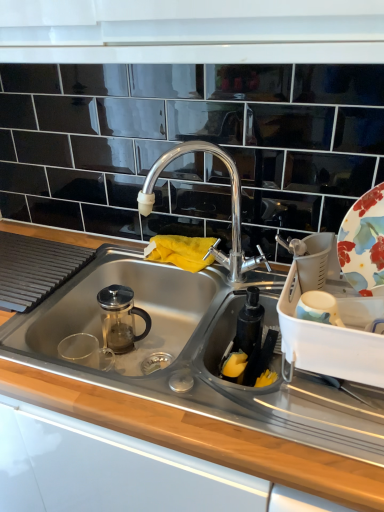
Question: From a real-world perspective, is floral ceramic platter at right positioned above or below stainless steel sink at center?

Choices:
 (A) below
 (B) above

Answer: (B)

Question: Do you think floral ceramic platter at right is within stainless steel sink at center, or outside of it?

Choices:
 (A) outside
 (B) inside

Answer: (A)

Question: Considering the real-world distances, which object is closest to the floral ceramic platter at right?

Choices:
 (A) polished chrome faucet at center
 (B) stainless steel sink at center

Answer: (A)

Question: Which object is the farthest from the stainless steel sink at center?

Choices:
 (A) floral ceramic platter at right
 (B) polished chrome faucet at center

Answer: (A)